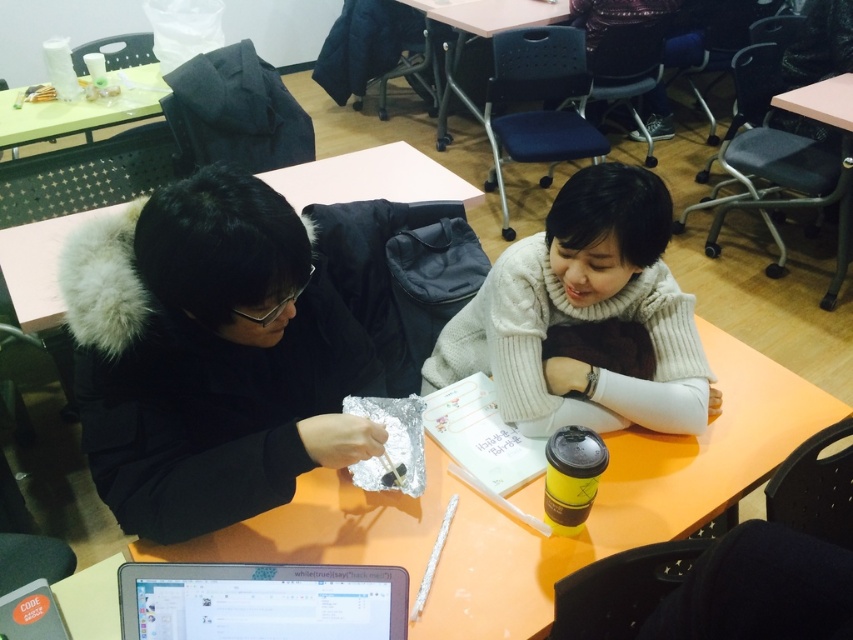
Can you confirm if silver metallic laptop at center is bigger than green plastic table at upper left?

Actually, silver metallic laptop at center might be smaller than green plastic table at upper left.

Describe the element at coordinates (260, 602) in the screenshot. Image resolution: width=853 pixels, height=640 pixels. I see `silver metallic laptop at center` at that location.

Does point (129, 614) lie in front of point (13, 144)?

Yes, it is.

The height and width of the screenshot is (640, 853). In order to click on silver metallic laptop at center in this screenshot , I will do `click(260, 602)`.

Does point (708, 477) come farther from viewer compared to point (822, 88)?

No.

Locate an element on the screen. This screenshot has width=853, height=640. orange matte table at center is located at coordinates [531, 529].

What do you see at coordinates (210, 355) in the screenshot? The image size is (853, 640). I see `black fuzzy coat at left` at bounding box center [210, 355].

Based on the photo, is black fuzzy coat at left wider than matte plastic table at center?

In fact, black fuzzy coat at left might be narrower than matte plastic table at center.

I want to click on black fuzzy coat at left, so click(x=210, y=355).